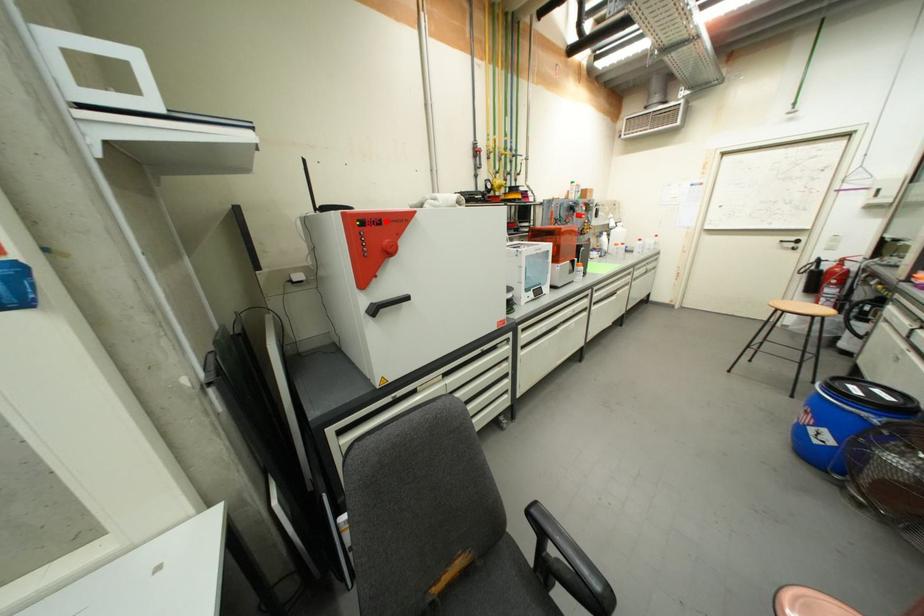
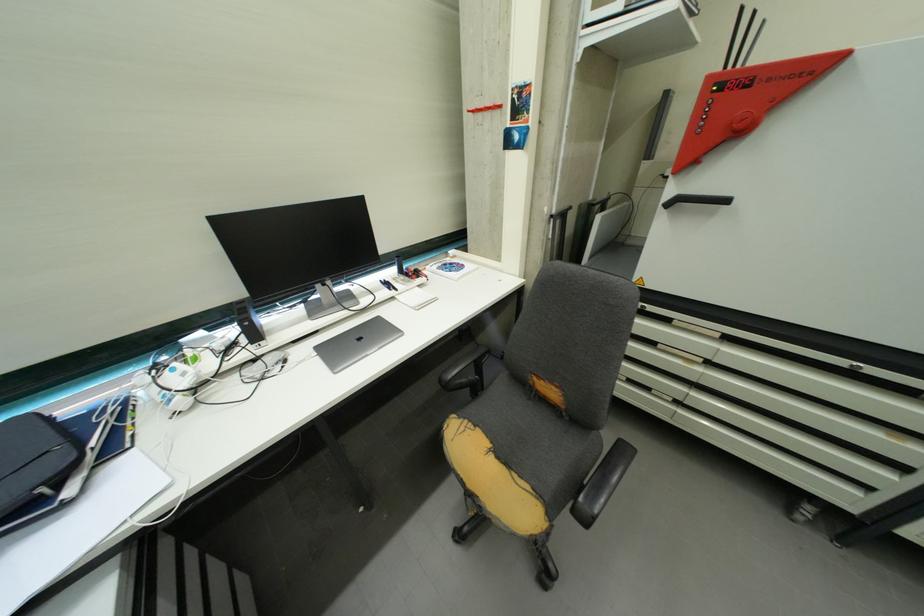
In the second image, find the point that corresponds to the highlighted location in the first image.

(759, 81)